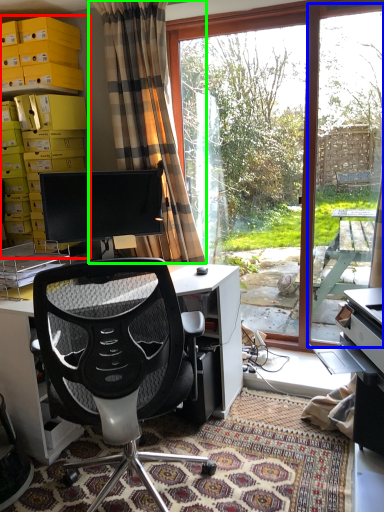
Question: Considering the real-world distances, which object is closest to shelf (highlighted by a red box)? screen door (highlighted by a blue box) or curtain (highlighted by a green box).

Choices:
 (A) screen door
 (B) curtain

Answer: (B)